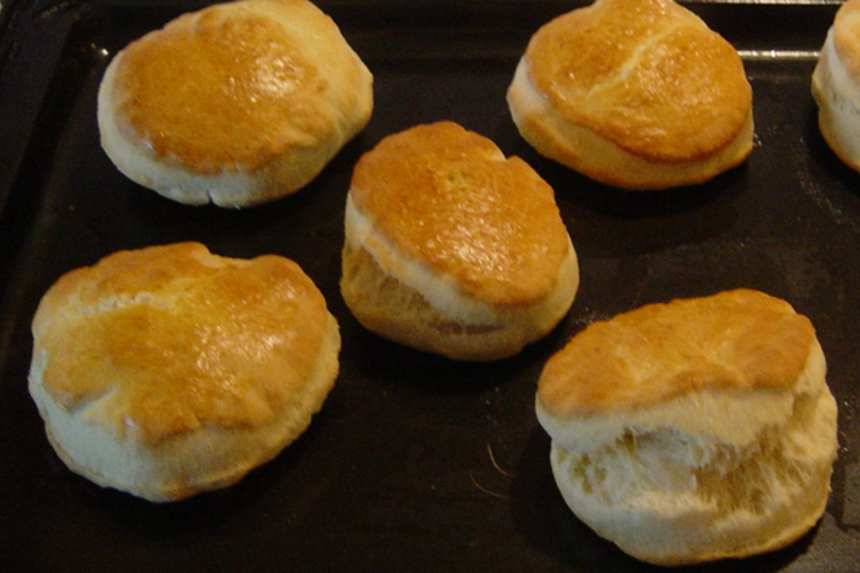
Where is `baking pan`? The width and height of the screenshot is (860, 573). baking pan is located at coordinates (734, 239).